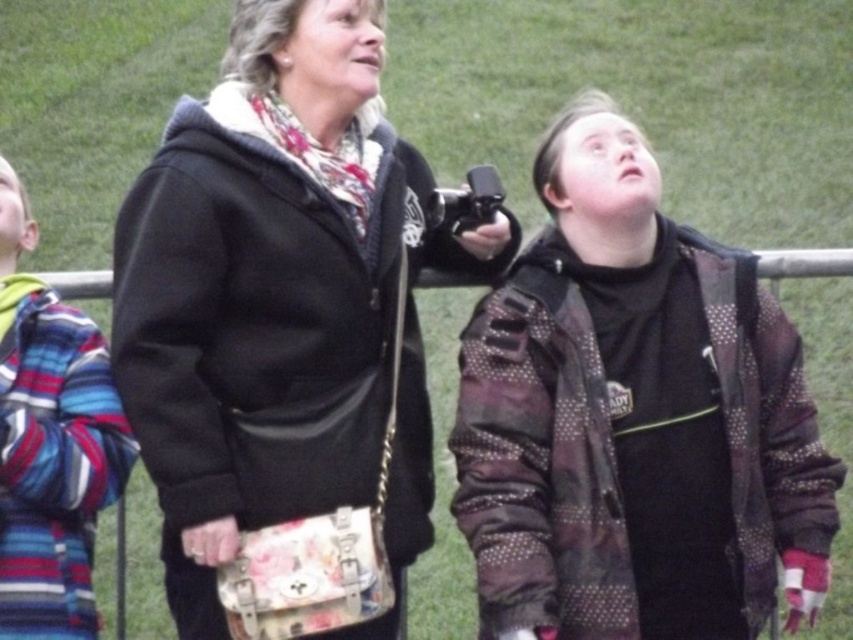
Question: Which is nearer to the black fabric jacket at center?

Choices:
 (A) black plastic video camera at center
 (B) camouflage jacket at center

Answer: (A)

Question: Can you confirm if black fabric jacket at center is wider than black plastic video camera at center?

Choices:
 (A) no
 (B) yes

Answer: (B)

Question: Does camouflage jacket at center have a lesser width compared to black fabric jacket at center?

Choices:
 (A) yes
 (B) no

Answer: (A)

Question: Is camouflage jacket at center wider than black plastic video camera at center?

Choices:
 (A) no
 (B) yes

Answer: (B)

Question: Among these objects, which one is nearest to the camera?

Choices:
 (A) camouflage jacket at center
 (B) black fabric jacket at center
 (C) striped wool sweater at left

Answer: (C)

Question: Which of the following is the closest to the observer?

Choices:
 (A) camouflage jacket at center
 (B) black plastic video camera at center

Answer: (A)